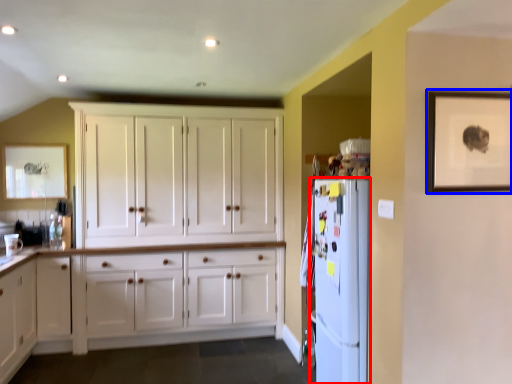
Question: Which point is further to the camera, refrigerator (highlighted by a red box) or picture frame (highlighted by a blue box)?

Choices:
 (A) refrigerator
 (B) picture frame

Answer: (A)